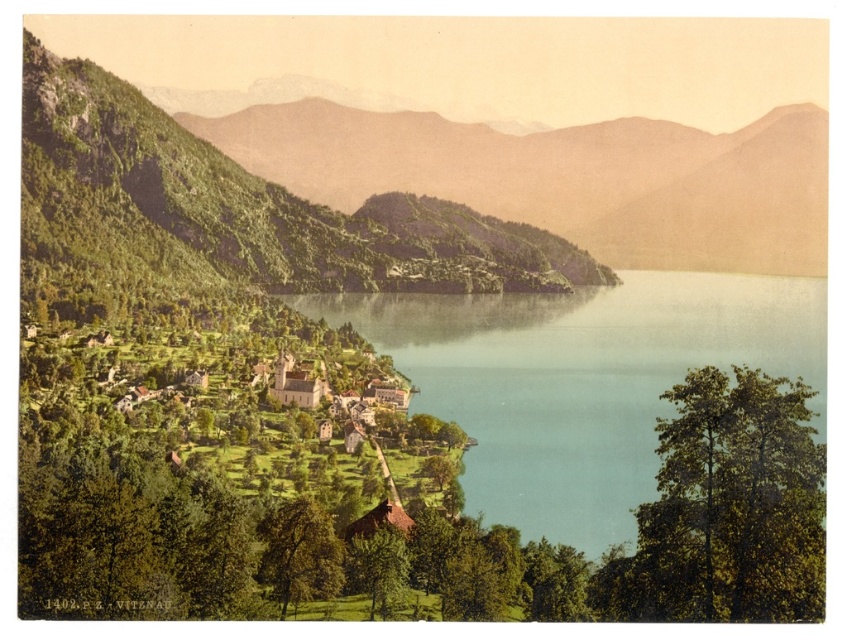
You are a hiker standing at the edge of the green grassy hillside at center and want to take a photo of the green matte tree at lower left. Which object should you focus on first if you want both to be in the frame?

The green grassy hillside at center is larger in size compared to the green matte tree at lower left, so you should focus on the green grassy hillside at center first to ensure it fits properly in the frame.